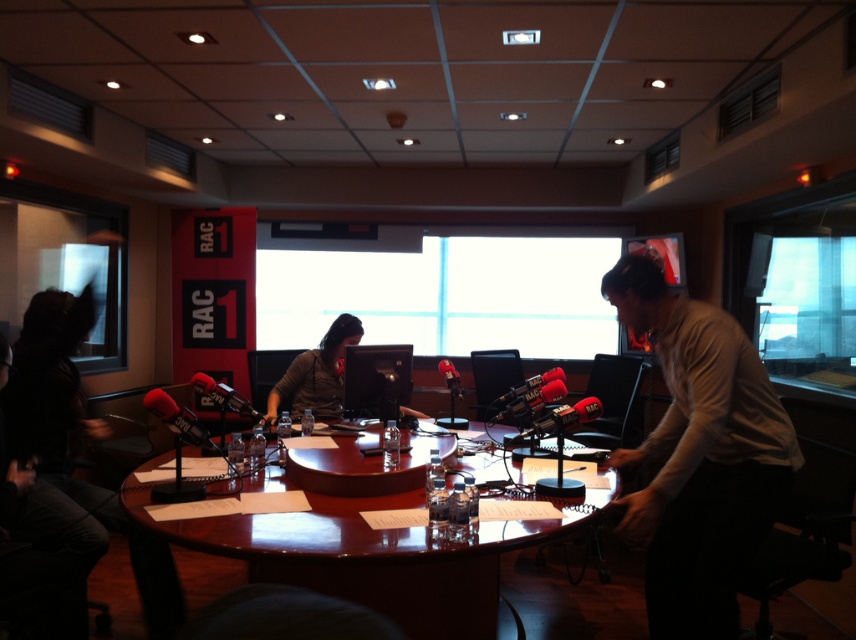
You are a guest on a live radio show and need to sit down at the round wooden table. The host tells you to sit to the left of the matte black monitor at center. Where should you position yourself relative to the white shirt at center?

You should sit to the left of the matte black monitor at center, which places you to the left of the white shirt at center since the white shirt at center is to the right of the matte black monitor at center.

You are a guest speaker in the radio studio and need to place your notes on the surface that is higher between the shiny wooden table at center and the matte black monitor at center. Which object should you choose?

The shiny wooden table at center is much taller than the matte black monitor at center, so you should place your notes on the shiny wooden table at center.

You are a guest speaker in the radio studio and need to grab a water bottle from the table. The white shirt at center is your host, and the matte black monitor at center is the main camera. To avoid blocking the camera, you must stay at least 1.5 meters away from the monitor. Are you currently positioned safely?

The distance between the white shirt at center and the matte black monitor at center is 1.89 meters. Since you need to stay at least 1.5 meters away from the monitor, your current position is safe as 1.89 meters exceeds the required distance.